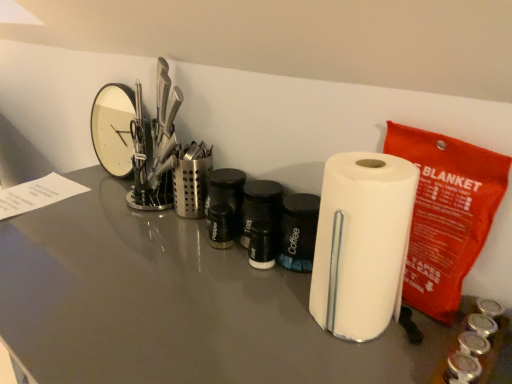
Question: Does satin silver utensil holder at center, which is counted as the second stationery, starting from the front, appear on the right side of white matte paper towel at center?

Choices:
 (A) yes
 (B) no

Answer: (B)

Question: Is satin silver utensil holder at center, which is the second stationery in right-to-left order, closer to the viewer compared to white matte paper towel at center?

Choices:
 (A) yes
 (B) no

Answer: (B)

Question: From a real-world perspective, is satin silver utensil holder at center, which is the second stationery in right-to-left order, physically above white matte paper towel at center?

Choices:
 (A) no
 (B) yes

Answer: (A)

Question: Can you confirm if satin silver utensil holder at center, which is the second stationery in right-to-left order, is smaller than white matte paper towel at center?

Choices:
 (A) yes
 (B) no

Answer: (A)

Question: Is satin silver utensil holder at center, which is counted as the second stationery, starting from the front, shorter than white matte paper towel at center?

Choices:
 (A) no
 (B) yes

Answer: (B)

Question: Considering the positions of point (17, 349) and point (186, 150), is point (17, 349) closer or farther from the camera than point (186, 150)?

Choices:
 (A) farther
 (B) closer

Answer: (B)

Question: From a real-world perspective, is white glossy paper towel holder at center physically located above or below satin silver utensil holder at center, which is the second stationery in right-to-left order?

Choices:
 (A) below
 (B) above

Answer: (A)

Question: From the image's perspective, is white glossy paper towel holder at center located above or below satin silver utensil holder at center, which is counted as the second stationery, starting from the front?

Choices:
 (A) below
 (B) above

Answer: (A)

Question: Considering the relative positions of white glossy paper towel holder at center and satin silver utensil holder at center, which is the second stationery in right-to-left order, in the image provided, is white glossy paper towel holder at center to the left or to the right of satin silver utensil holder at center, which is the second stationery in right-to-left order,?

Choices:
 (A) right
 (B) left

Answer: (B)

Question: Choose the correct answer: Is white paper towel at right, the 1th stationery from the front, inside white glossy paper towel holder at center or outside it?

Choices:
 (A) outside
 (B) inside

Answer: (A)

Question: From the image's perspective, is white paper towel at right, the 2th stationery when ordered from back to front, located above or below white glossy paper towel holder at center?

Choices:
 (A) below
 (B) above

Answer: (B)

Question: From a real-world perspective, relative to white glossy paper towel holder at center, is white paper towel at right, the 1th stationery from the front, vertically above or below?

Choices:
 (A) below
 (B) above

Answer: (B)

Question: Considering the positions of white paper towel at right, the 1th stationery from the front, and white glossy paper towel holder at center in the image, is white paper towel at right, the 1th stationery from the front, taller or shorter than white glossy paper towel holder at center?

Choices:
 (A) tall
 (B) short

Answer: (B)

Question: Is satin silver utensil holder at center, which is counted as the second stationery, starting from the front, taller or shorter than white matte paper towel at center?

Choices:
 (A) short
 (B) tall

Answer: (A)

Question: Considering the positions of point [201, 165] and point [395, 256], is point [201, 165] closer or farther from the camera than point [395, 256]?

Choices:
 (A) farther
 (B) closer

Answer: (A)